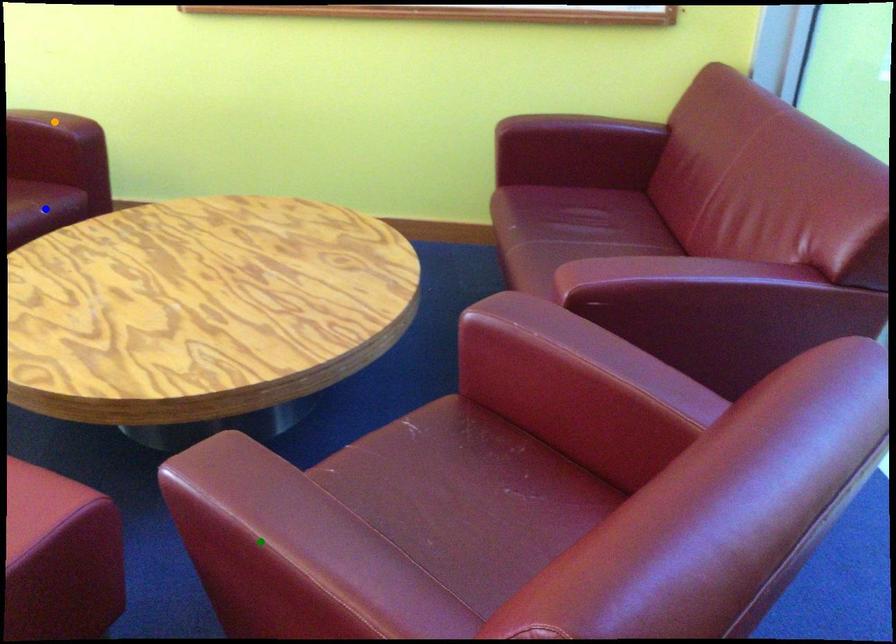
Order these from nearest to farthest:
A) blue point
B) green point
C) orange point

green point < blue point < orange point